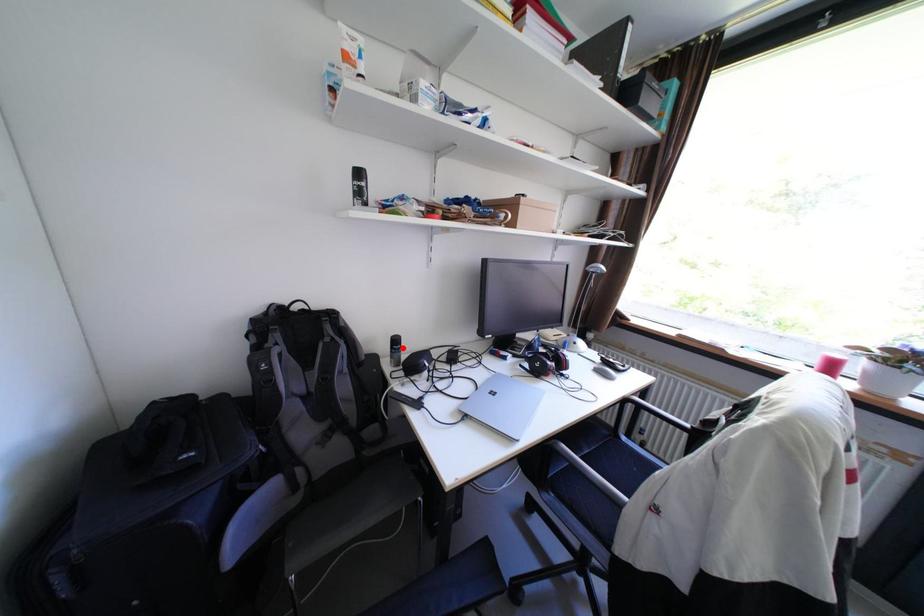
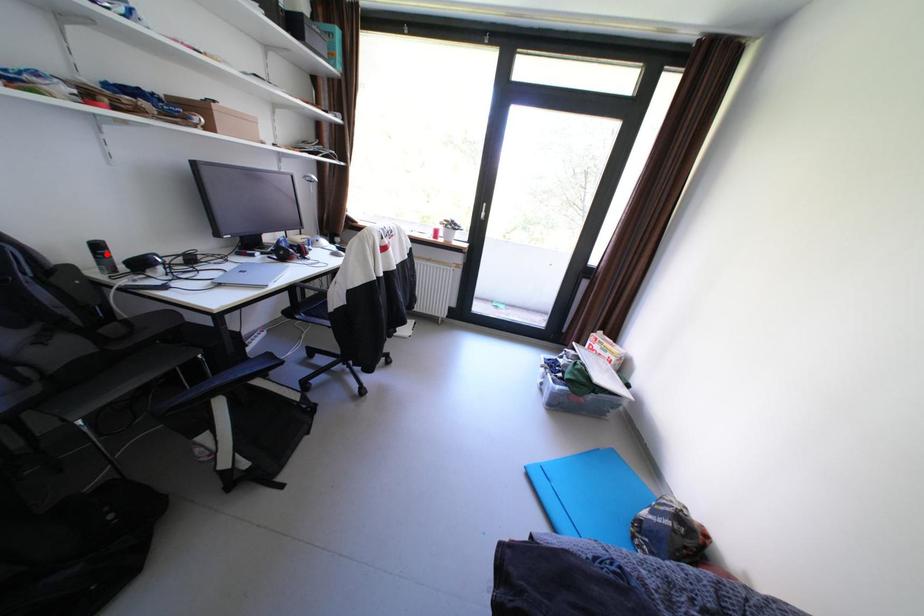
I am providing you with two images of the same scene from different viewpoints. A red point is marked on the first image and another point is marked on the second image. Is the marked point in image1 the same physical position as the marked point in image2?

Yes